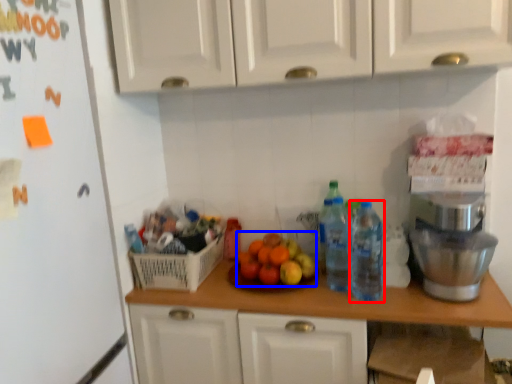
Question: Among these objects, which one is nearest to the camera, kitchen appliance (highlighted by a red box) or fruit (highlighted by a blue box)?

Choices:
 (A) kitchen appliance
 (B) fruit

Answer: (A)